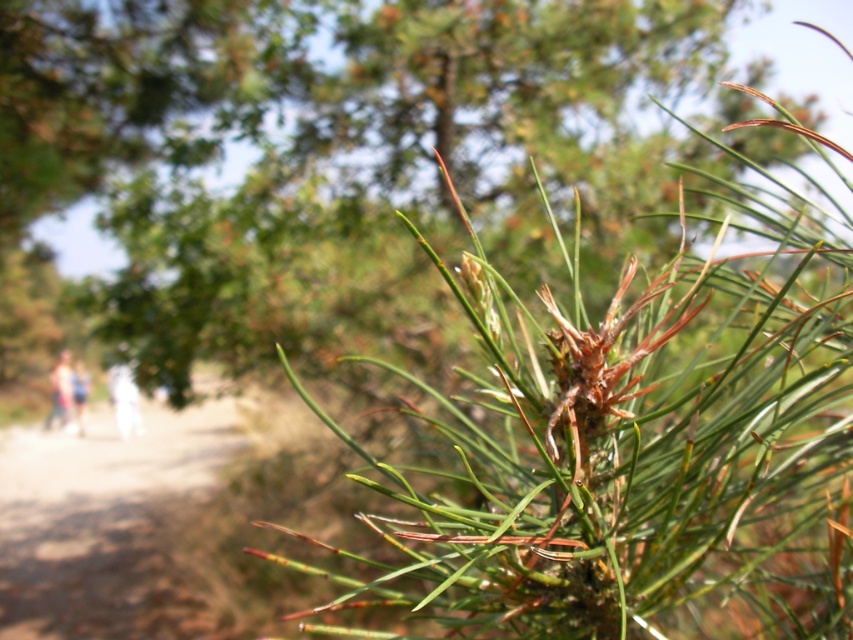
Question: Which of the following is the closest to the observer?

Choices:
 (A) white cotton pants at left
 (B) light blue jeans at left
 (C) white cotton pants at lower left

Answer: (A)

Question: Among these objects, which one is nearest to the camera?

Choices:
 (A) white cotton pants at lower left
 (B) light blue jeans at left

Answer: (B)

Question: Can you confirm if green needle-like at upper right is positioned to the right of green needle-like pine at upper right?

Choices:
 (A) no
 (B) yes

Answer: (A)

Question: Does green needle-like at upper right appear over brown dirt trail at lower left?

Choices:
 (A) yes
 (B) no

Answer: (A)

Question: Is the position of light blue jeans at left more distant than that of white cotton pants at lower left?

Choices:
 (A) no
 (B) yes

Answer: (A)

Question: Which object is the farthest from the white cotton pants at lower left?

Choices:
 (A) white cotton pants at left
 (B) light blue jeans at left

Answer: (A)